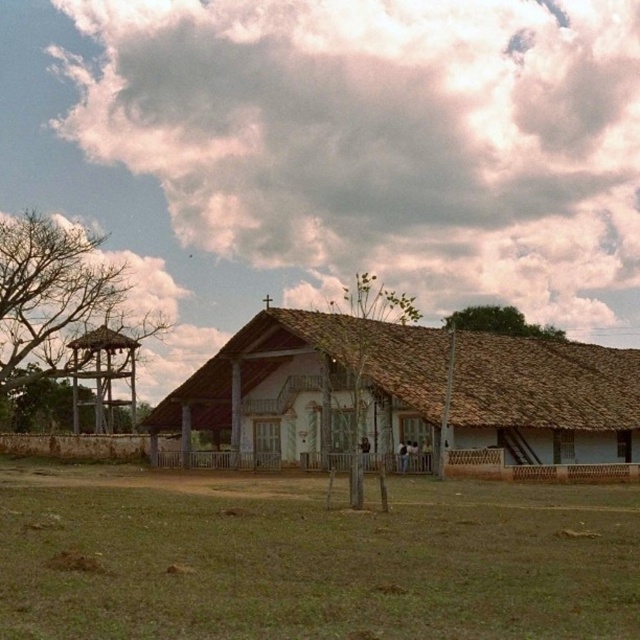
Is cloudy sky at upper center wider than white wooden hut at center?

Yes, cloudy sky at upper center is wider than white wooden hut at center.

The width and height of the screenshot is (640, 640). What do you see at coordinates (385, 138) in the screenshot?
I see `cloudy sky at upper center` at bounding box center [385, 138].

Where is `cloudy sky at upper center`? The width and height of the screenshot is (640, 640). cloudy sky at upper center is located at coordinates (385, 138).

I want to click on cloudy sky at upper center, so click(385, 138).

Who is taller, green grass at center or wooden lattice gazebo at left?

wooden lattice gazebo at left is taller.

From the picture: Is green grass at center to the left of wooden lattice gazebo at left from the viewer's perspective?

No, green grass at center is not to the left of wooden lattice gazebo at left.

You are a GUI agent. You are given a task and a screenshot of the screen. Output one action in this format:
    pyautogui.click(x=<x>, y=<y>)
    Task: Click on the green grass at center
    The width and height of the screenshot is (640, 640).
    Given the screenshot: What is the action you would take?
    pyautogui.click(x=310, y=557)

Does point (76, 422) come closer to viewer compared to point (470, 323)?

Yes, point (76, 422) is in front of point (470, 323).

This screenshot has width=640, height=640. Identify the location of wooden lattice gazebo at left. (102, 376).

Which is behind, point (106, 369) or point (518, 314)?

The point (518, 314) is more distant.

Locate an element on the screen. The image size is (640, 640). wooden lattice gazebo at left is located at coordinates (102, 376).